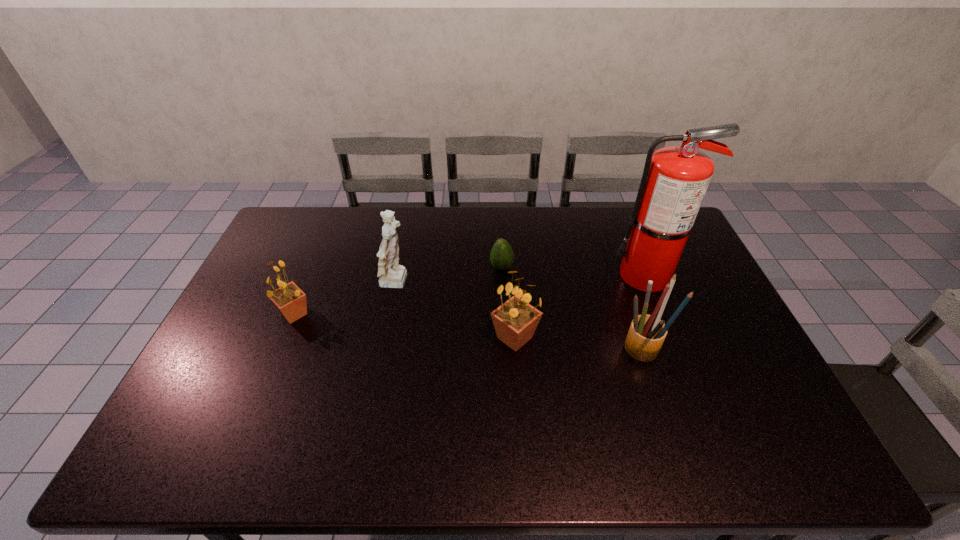
Where is `the left sunflower`? The height and width of the screenshot is (540, 960). the left sunflower is located at coordinates (289, 299).

The image size is (960, 540). Identify the location of the leftmost object. (289, 299).

I want to click on the right sunflower, so click(x=515, y=321).

The width and height of the screenshot is (960, 540). Find the location of `figurine`. figurine is located at coordinates (391, 275).

At what (x,y) coordinates should I click in order to perform the action: click on the shortest object. Please return your answer as a coordinate pair (x, y). This screenshot has width=960, height=540. Looking at the image, I should click on (501, 256).

You are a GUI agent. You are given a task and a screenshot of the screen. Output one action in this format:
    pyautogui.click(x=<x>, y=<y>)
    Task: Click on the tallest object
    The height and width of the screenshot is (540, 960).
    Given the screenshot: What is the action you would take?
    pyautogui.click(x=675, y=179)

Find the location of `pencil box`. pencil box is located at coordinates (646, 334).

Find the location of a particular element. The image size is (960, 540). free space located 0.080m at the front of the second shortest object with flowers visible is located at coordinates (249, 314).

Locate an element on the screen. This screenshot has height=540, width=960. vacant point located 0.130m at the front of the second shortest object with flowers visible is located at coordinates (232, 314).

Find the location of a particular element. The image size is (960, 540). free region located at the front of the second shortest object with flowers visible is located at coordinates (239, 314).